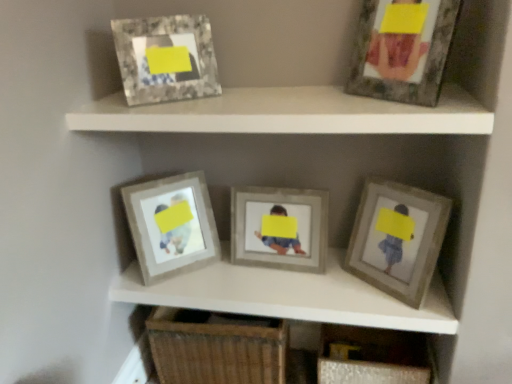
Locate an element on the screen. The width and height of the screenshot is (512, 384). free space above matte gray frame at center (from a real-world perspective) is located at coordinates (281, 283).